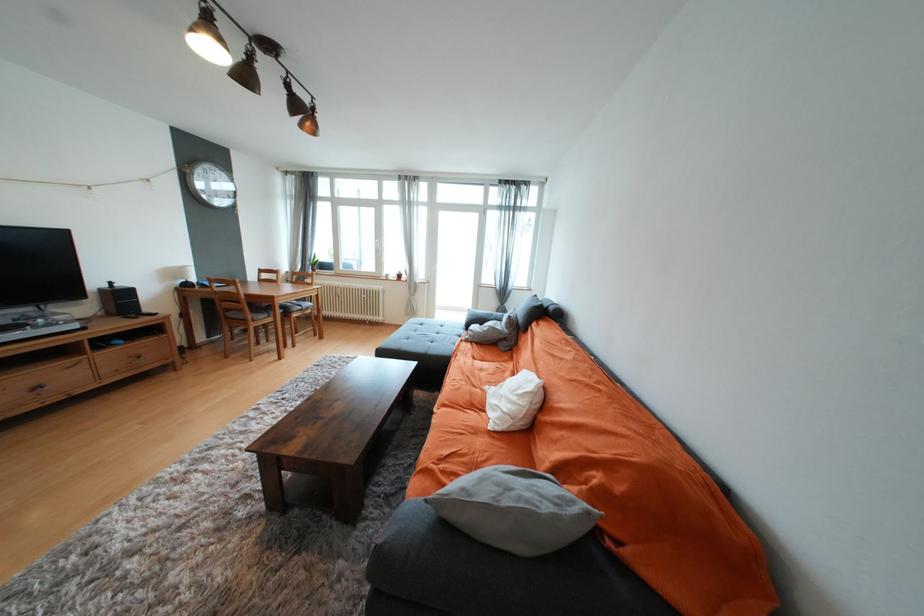
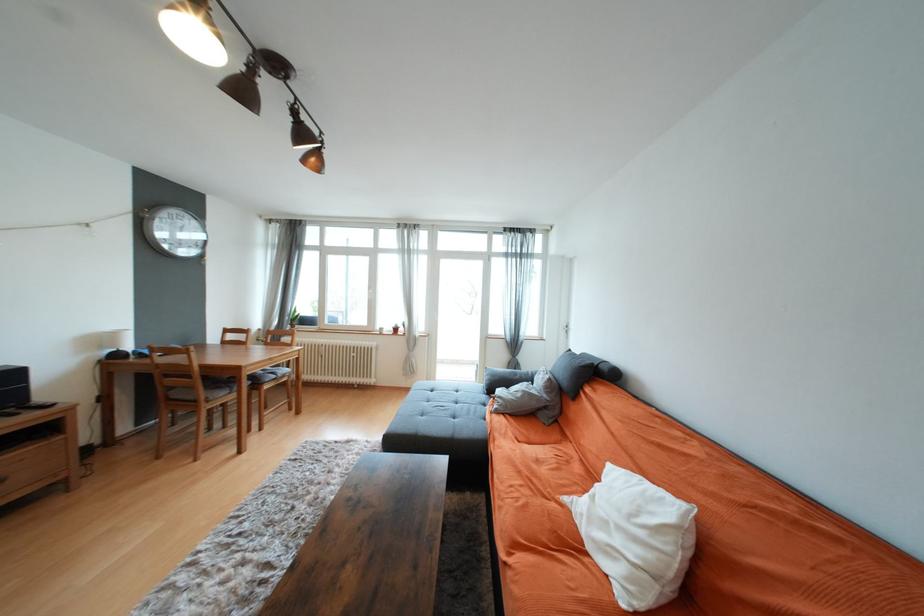
In the second image, find the point that corresponds to (x=237, y=315) in the first image.

(181, 395)